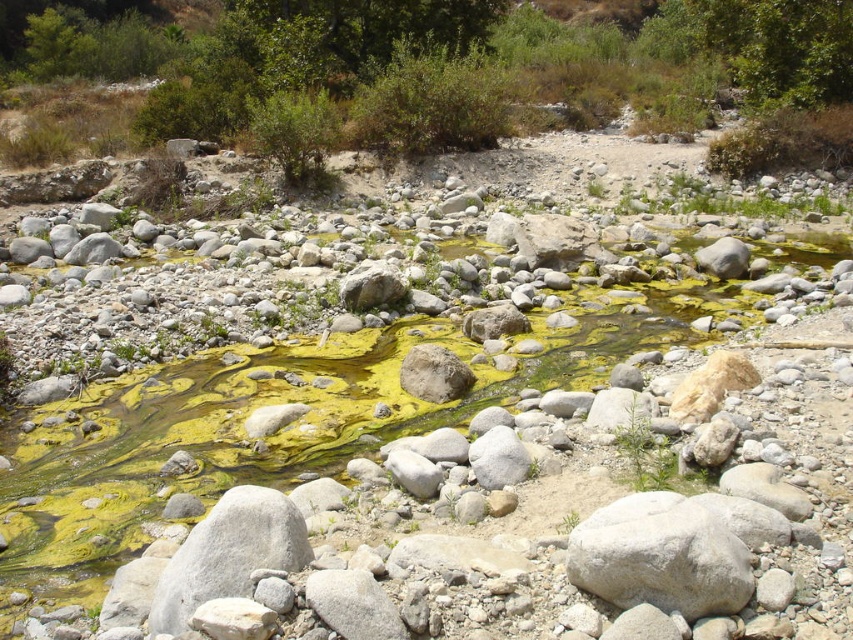
Does yellow-green algae at center have a greater height compared to gray/smooth rock at center?

Indeed, yellow-green algae at center has a greater height compared to gray/smooth rock at center.

The height and width of the screenshot is (640, 853). What do you see at coordinates (167, 452) in the screenshot? I see `yellow-green algae at center` at bounding box center [167, 452].

Locate an element on the screen. yellow-green algae at center is located at coordinates (167, 452).

Is green leafy shrubs at upper center to the left of green leafy bush at center from the viewer's perspective?

Incorrect, green leafy shrubs at upper center is not on the left side of green leafy bush at center.

Based on the photo, between green leafy shrubs at upper center and green leafy bush at center, which one has less height?

green leafy bush at center

What do you see at coordinates (457, 68) in the screenshot?
I see `green leafy shrubs at upper center` at bounding box center [457, 68].

You are a GUI agent. You are given a task and a screenshot of the screen. Output one action in this format:
    pyautogui.click(x=<x>, y=<y>)
    Task: Click on the green leafy shrubs at upper center
    
    Given the screenshot: What is the action you would take?
    pyautogui.click(x=457, y=68)

Does point (4, 568) come closer to viewer compared to point (650, 80)?

Yes.

Describe the element at coordinates (167, 452) in the screenshot. I see `yellow-green algae at center` at that location.

Identify the location of yellow-green algae at center. (167, 452).